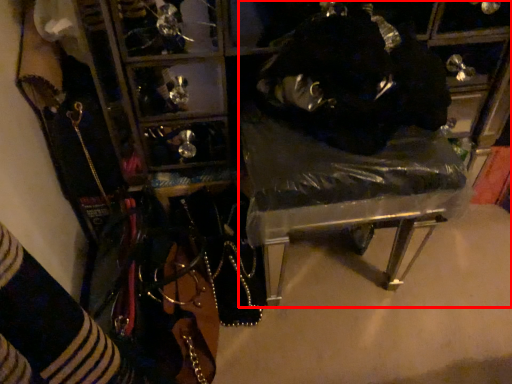
Question: From the image's perspective, considering the relative positions of furniture (annotated by the red box) and person in the image provided, where is furniture (annotated by the red box) located with respect to the staircase?

Choices:
 (A) above
 (B) below

Answer: (B)